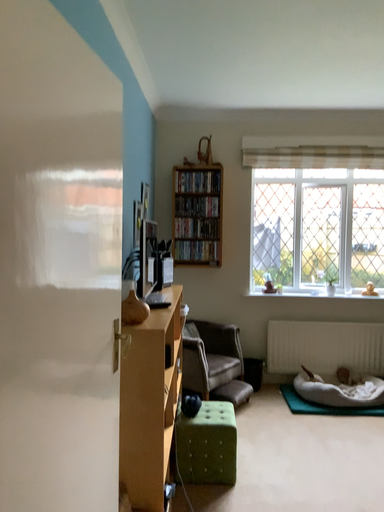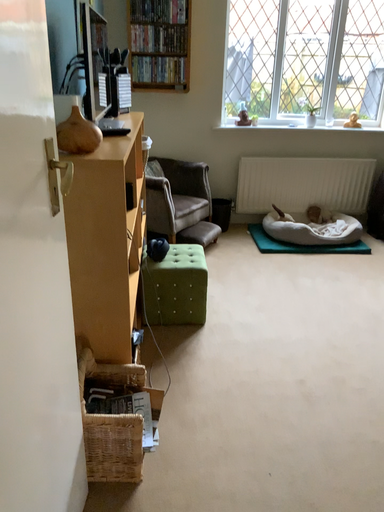
Question: Which way did the camera rotate in the video?

Choices:
 (A) rotated upward
 (B) rotated downward

Answer: (B)